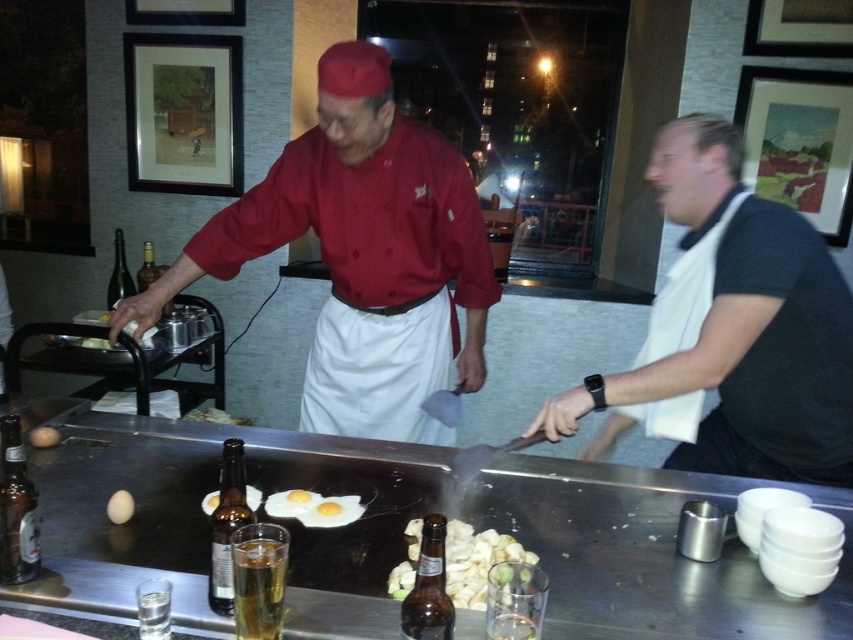
Is point (350, 369) positioned in front of point (757, 273)?

No.

Between point (306, 212) and point (686, 364), which one is positioned behind?

Positioned behind is point (306, 212).

Who is more distant from viewer, [373,256] or [810,305]?

Positioned behind is point [373,256].

Locate an element on the screen. Image resolution: width=853 pixels, height=640 pixels. matte red chef's jacket at center is located at coordinates (361, 253).

Does amber glass bottle at center have a greater height compared to white matte egg at center?

Correct, amber glass bottle at center is much taller as white matte egg at center.

Is amber glass bottle at center thinner than white matte egg at center?

Correct, amber glass bottle at center's width is less than white matte egg at center's.

The width and height of the screenshot is (853, 640). Find the location of `amber glass bottle at center`. amber glass bottle at center is located at coordinates (227, 525).

Is translucent glass beer bottle at center shorter than amber glass bottle at center?

Yes, translucent glass beer bottle at center is shorter than amber glass bottle at center.

Does point (438, 634) come in front of point (209, 580)?

That is True.

I want to click on translucent glass beer bottle at center, so click(428, 588).

Locate an element on the screen. translucent glass beer bottle at center is located at coordinates (428, 588).